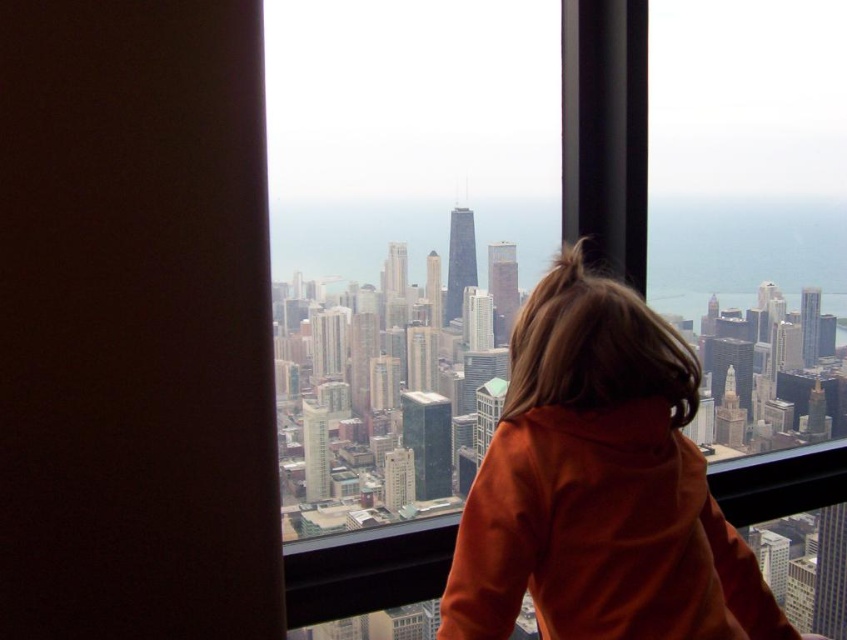
Question: Which object appears closest to the camera in this image?

Choices:
 (A) orange fleece at center
 (B) transparent glass window at center

Answer: (B)

Question: Does transparent glass window at center come in front of orange fleece at center?

Choices:
 (A) no
 (B) yes

Answer: (B)

Question: In this image, where is transparent glass window at center located relative to orange fleece at center?

Choices:
 (A) left
 (B) right

Answer: (A)

Question: Which of the following is the farthest from the observer?

Choices:
 (A) orange fleece at center
 (B) transparent glass window at center

Answer: (A)

Question: Is transparent glass window at center smaller than orange fleece at center?

Choices:
 (A) yes
 (B) no

Answer: (B)

Question: Which point is farther from the camera taking this photo?

Choices:
 (A) (475, 584)
 (B) (809, 129)

Answer: (B)